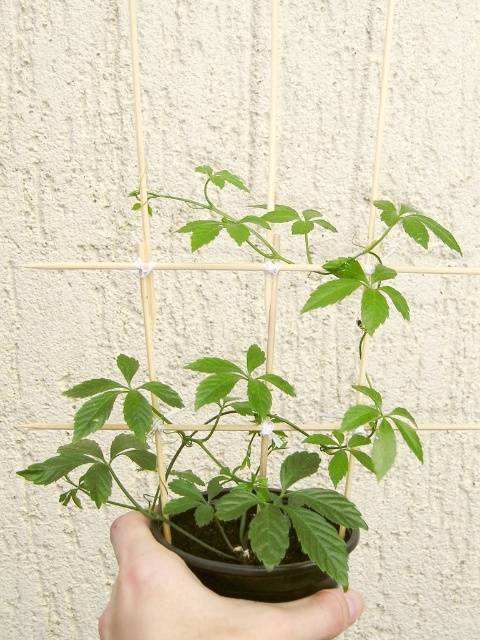
Who is more forward, [94,492] or [292,621]?

Point [292,621]

Does green matte plant at center appear on the right side of black matte hand at center?

Correct, you'll find green matte plant at center to the right of black matte hand at center.

Describe the element at coordinates (229, 467) in the screenshot. This screenshot has height=640, width=480. I see `green matte plant at center` at that location.

Locate an element on the screen. The height and width of the screenshot is (640, 480). green matte plant at center is located at coordinates (229, 467).